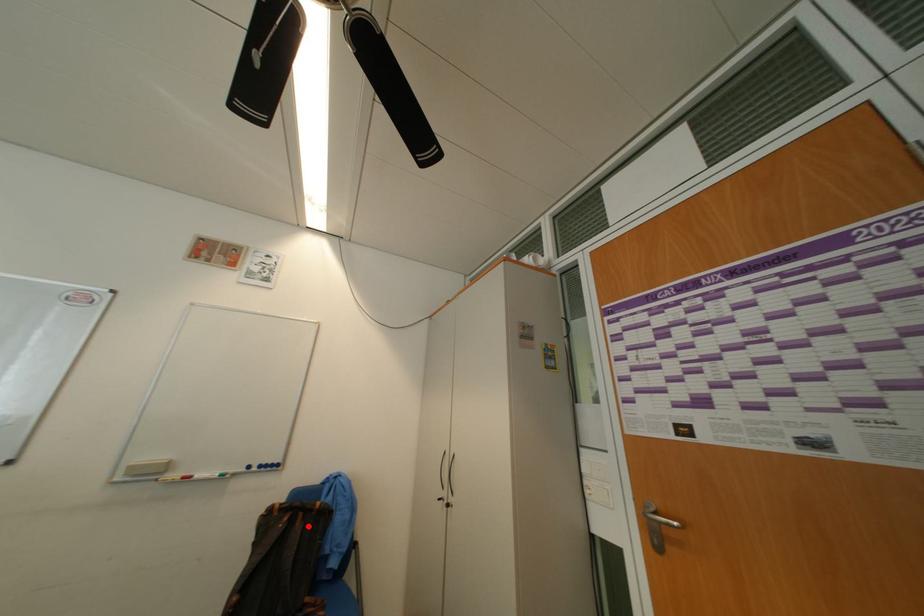
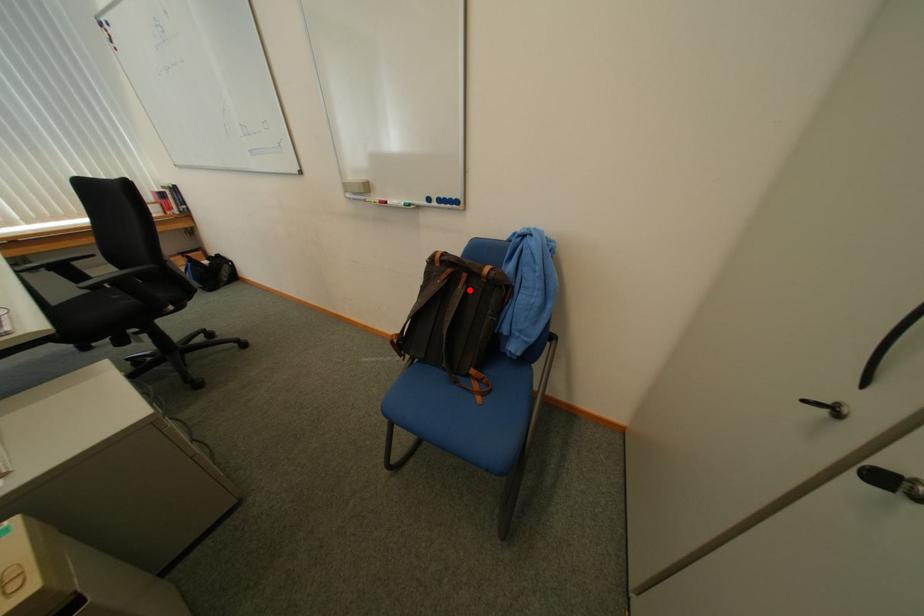
I am providing you with two images of the same scene from different viewpoints. A red point is marked on the first image and another point is marked on the second image. Are the points marked in image1 and image2 representing the same 3D position?

Yes